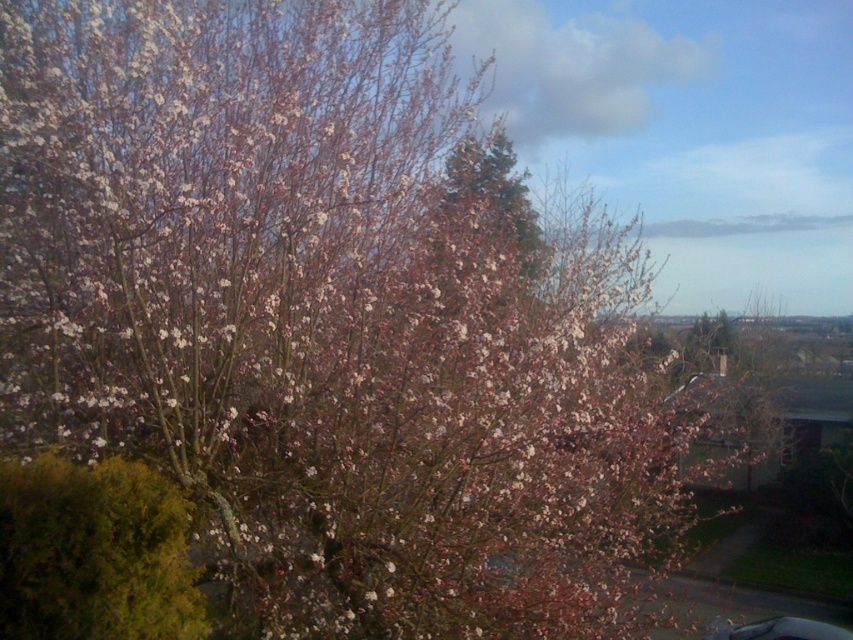
Is point (189, 614) closer to viewer compared to point (492, 140)?

Yes, it is.

Is green mossy bush at lower left positioned in front of pink blossoms at center?

That is True.

Who is more forward, (30, 524) or (497, 218)?

Point (30, 524) is more forward.

This screenshot has width=853, height=640. Find the location of `green mossy bush at lower left`. green mossy bush at lower left is located at coordinates (94, 554).